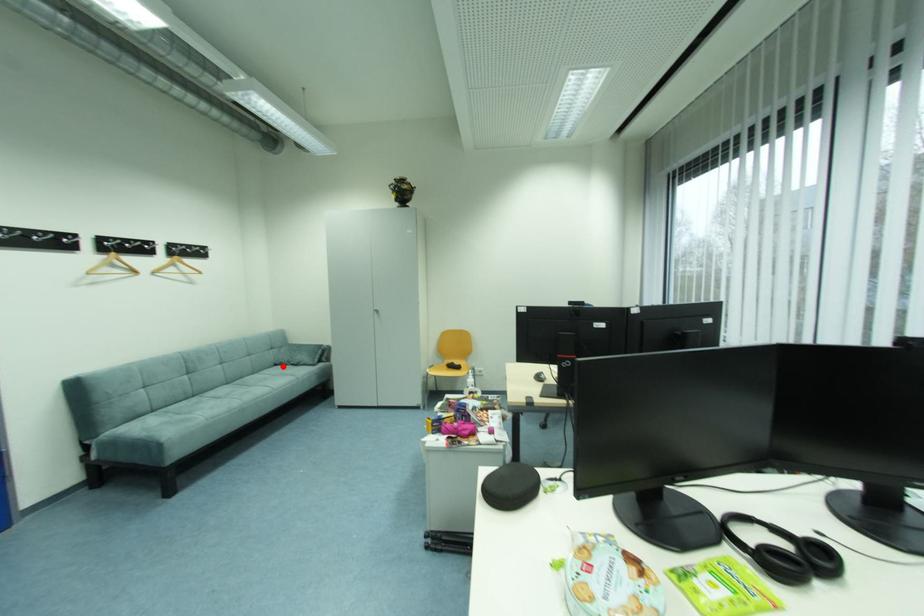
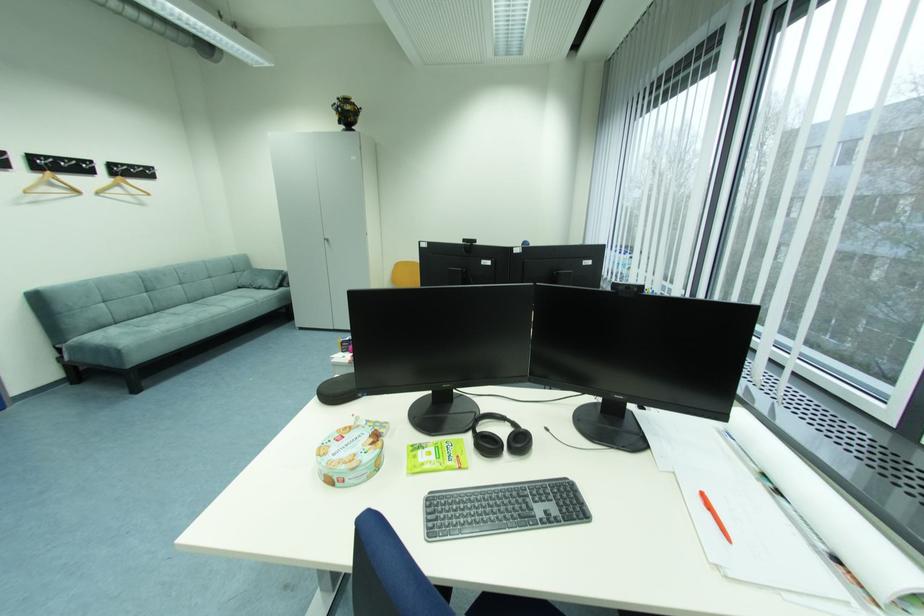
In the second image, find the point that corresponds to the highlighted location in the first image.

(246, 288)